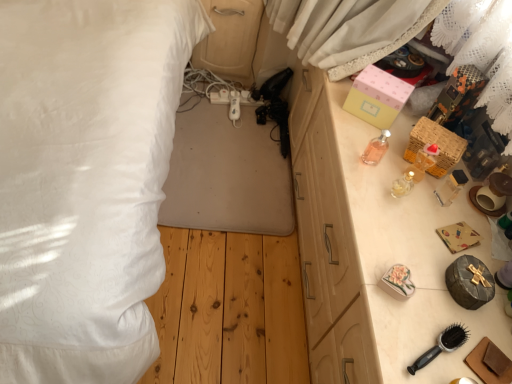
What do you see at coordinates (230, 39) in the screenshot? I see `matte wood dresser at center` at bounding box center [230, 39].

Describe the element at coordinates (85, 181) in the screenshot. The height and width of the screenshot is (384, 512). I see `white fabric bed at left` at that location.

Locate an element on the screen. The height and width of the screenshot is (384, 512). matte wood dresser at center is located at coordinates (230, 39).

From a real-world perspective, between wooden drawer at right and pink glass perfume at upper right, who is vertically higher?

pink glass perfume at upper right, from a real-world perspective.

From the picture: Can you tell me how much wooden drawer at right and pink glass perfume at upper right differ in facing direction?

1.89 degrees.

You are a GUI agent. You are given a task and a screenshot of the screen. Output one action in this format:
    pyautogui.click(x=<x>, y=<y>)
    Task: Click on the toiletry that appears behind the wooden drawer at right
    
    Given the screenshot: What is the action you would take?
    pyautogui.click(x=376, y=149)

Would you say wooden drawer at right is to the left or to the right of pink glass perfume at upper right in the picture?

wooden drawer at right is to the right of pink glass perfume at upper right.

Visually, is matte wood dresser at center positioned to the left or to the right of woven wicker basket at right, marked as the second box in a top-to-bottom arrangement?

matte wood dresser at center is to the left of woven wicker basket at right, marked as the second box in a top-to-bottom arrangement.

Is matte wood dresser at center with woven wicker basket at right, arranged as the first box when ordered from the bottom?

No.

Can you confirm if matte wood dresser at center is smaller than woven wicker basket at right, marked as the second box in a top-to-bottom arrangement?

Incorrect, matte wood dresser at center is not smaller in size than woven wicker basket at right, marked as the second box in a top-to-bottom arrangement.

Measure the distance from matte wood dresser at center to woven wicker basket at right, marked as the second box in a top-to-bottom arrangement.

matte wood dresser at center is 3.61 feet away from woven wicker basket at right, marked as the second box in a top-to-bottom arrangement.

Considering the sizes of objects woven wicker basket at right, marked as the second box in a top-to-bottom arrangement, and black plastic hairbrush at lower right in the image provided, who is thinner, woven wicker basket at right, marked as the second box in a top-to-bottom arrangement, or black plastic hairbrush at lower right?

woven wicker basket at right, marked as the second box in a top-to-bottom arrangement.

From the picture: Considering the relative sizes of woven wicker basket at right, marked as the second box in a top-to-bottom arrangement, and black plastic hairbrush at lower right in the image provided, is woven wicker basket at right, marked as the second box in a top-to-bottom arrangement, bigger than black plastic hairbrush at lower right?

Yes.

Considering the relative sizes of woven wicker basket at right, arranged as the first box when ordered from the bottom, and black plastic hairbrush at lower right in the image provided, is woven wicker basket at right, arranged as the first box when ordered from the bottom, shorter than black plastic hairbrush at lower right?

Incorrect, the height of woven wicker basket at right, arranged as the first box when ordered from the bottom, does not fall short of that of black plastic hairbrush at lower right.

From the image's perspective, between woven wicker basket at right, arranged as the first box when ordered from the bottom, and black plastic hairbrush at lower right, which one is located above?

woven wicker basket at right, arranged as the first box when ordered from the bottom, is shown above in the image.

Considering the relative positions of woven wicker basket at right, arranged as the first box when ordered from the bottom, and pink paper box at upper right, which is the second box from bottom to top, in the image provided, is woven wicker basket at right, arranged as the first box when ordered from the bottom, in front of pink paper box at upper right, which is the second box from bottom to top,?

Yes, woven wicker basket at right, arranged as the first box when ordered from the bottom, is in front of pink paper box at upper right, which is the second box from bottom to top.

From a real-world perspective, is woven wicker basket at right, marked as the second box in a top-to-bottom arrangement, physically below pink paper box at upper right, which is the second box from bottom to top?

Yes.

Between woven wicker basket at right, arranged as the first box when ordered from the bottom, and pink paper box at upper right, which ranks as the 1th box in top-to-bottom order, which one has smaller size?

With smaller size is woven wicker basket at right, arranged as the first box when ordered from the bottom.

Is woven wicker basket at right, arranged as the first box when ordered from the bottom, touching pink paper box at upper right, which ranks as the 1th box in top-to-bottom order?

No, woven wicker basket at right, arranged as the first box when ordered from the bottom, is not with pink paper box at upper right, which ranks as the 1th box in top-to-bottom order.

I want to click on toiletry directly beneath the pink paper box at upper right, which ranks as the 1th box in top-to-bottom order (from a real-world perspective), so click(x=376, y=149).

Considering the relative sizes of pink paper box at upper right, which ranks as the 1th box in top-to-bottom order, and pink glass perfume at upper right in the image provided, is pink paper box at upper right, which ranks as the 1th box in top-to-bottom order, thinner than pink glass perfume at upper right?

No, pink paper box at upper right, which ranks as the 1th box in top-to-bottom order, is not thinner than pink glass perfume at upper right.

Which is more to the right, woven wicker basket at right, arranged as the first box when ordered from the bottom, or wooden drawer at right?

From the viewer's perspective, woven wicker basket at right, arranged as the first box when ordered from the bottom, appears more on the right side.

Is woven wicker basket at right, arranged as the first box when ordered from the bottom, aimed at wooden drawer at right?

No, woven wicker basket at right, arranged as the first box when ordered from the bottom, is not oriented towards wooden drawer at right.

Where is `box that is the 1st one when counting backward from the wooden drawer at right`? The height and width of the screenshot is (384, 512). box that is the 1st one when counting backward from the wooden drawer at right is located at coordinates (436, 143).

Considering the relative sizes of woven wicker basket at right, arranged as the first box when ordered from the bottom, and wooden drawer at right in the image provided, is woven wicker basket at right, arranged as the first box when ordered from the bottom, bigger than wooden drawer at right?

Incorrect, woven wicker basket at right, arranged as the first box when ordered from the bottom, is not larger than wooden drawer at right.

Considering the relative sizes of matte wood dresser at center and black plastic hairbrush at lower right in the image provided, is matte wood dresser at center thinner than black plastic hairbrush at lower right?

No, matte wood dresser at center is not thinner than black plastic hairbrush at lower right.

From a real-world perspective, between matte wood dresser at center and black plastic hairbrush at lower right, who is vertically lower?

In real-world perspective, matte wood dresser at center is lower.

Consider the image. Is matte wood dresser at center positioned with its back to black plastic hairbrush at lower right?

matte wood dresser at center is not turned away from black plastic hairbrush at lower right.

Is matte wood dresser at center completely or partially outside of black plastic hairbrush at lower right?

Yes, matte wood dresser at center is not within black plastic hairbrush at lower right.

Identify the location of table in front of the pink glass perfume at upper right. The image size is (512, 384). (410, 253).

Identify the location of dresser above the woven wicker basket at right, arranged as the first box when ordered from the bottom (from the image's perspective). (230, 39).

Considering their positions, is pink paper box at upper right, which ranks as the 1th box in top-to-bottom order, positioned further to black plastic hairbrush at lower right than white fabric bed at left?

Based on the image, white fabric bed at left appears to be further to black plastic hairbrush at lower right.

Considering their positions, is black plastic hairbrush at lower right positioned further to matte wood dresser at center than pink paper box at upper right, which ranks as the 1th box in top-to-bottom order?

Based on the image, black plastic hairbrush at lower right appears to be further to matte wood dresser at center.

Based on their spatial positions, is black plastic hairbrush at lower right or wooden drawer at right closer to pink paper box at upper right, which is the second box from bottom to top?

wooden drawer at right lies closer to pink paper box at upper right, which is the second box from bottom to top, than the other object.

Looking at this image, based on their spatial positions, is white fabric bed at left or woven wicker basket at right, arranged as the first box when ordered from the bottom, closer to wooden drawer at right?

The object closer to wooden drawer at right is woven wicker basket at right, arranged as the first box when ordered from the bottom.

Which object lies nearer to the anchor point matte wood dresser at center, white fabric bed at left or pink glass perfume at upper right?

white fabric bed at left is positioned closer to the anchor matte wood dresser at center.

Considering their positions, is pink glass perfume at upper right positioned further to pink paper box at upper right, which ranks as the 1th box in top-to-bottom order, than white fabric bed at left?

white fabric bed at left is further to pink paper box at upper right, which ranks as the 1th box in top-to-bottom order.

Estimate the real-world distances between objects in this image. Which object is further from woven wicker basket at right, arranged as the first box when ordered from the bottom, white fabric bed at left or pink glass perfume at upper right?

The object further to woven wicker basket at right, arranged as the first box when ordered from the bottom, is white fabric bed at left.

When comparing their distances from white fabric bed at left, does pink glass perfume at upper right or matte wood dresser at center seem closer?

matte wood dresser at center lies closer to white fabric bed at left than the other object.

At what (x,y) coordinates should I click in order to perform the action: click on toiletry between pink paper box at upper right, which ranks as the 1th box in top-to-bottom order, and woven wicker basket at right, arranged as the first box when ordered from the bottom, in the up-down direction. Please return your answer as a coordinate pair (x, y). The width and height of the screenshot is (512, 384). Looking at the image, I should click on (376, 149).

Image resolution: width=512 pixels, height=384 pixels. I want to click on table between pink glass perfume at upper right and black plastic hairbrush at lower right in the vertical direction, so click(x=410, y=253).

Where is `box positioned between wooden drawer at right and pink paper box at upper right, which is the second box from bottom to top, from near to far`? The image size is (512, 384). box positioned between wooden drawer at right and pink paper box at upper right, which is the second box from bottom to top, from near to far is located at coordinates (436, 143).

Where is `box between matte wood dresser at center and white fabric bed at left in the up-down direction`? Image resolution: width=512 pixels, height=384 pixels. box between matte wood dresser at center and white fabric bed at left in the up-down direction is located at coordinates (377, 97).